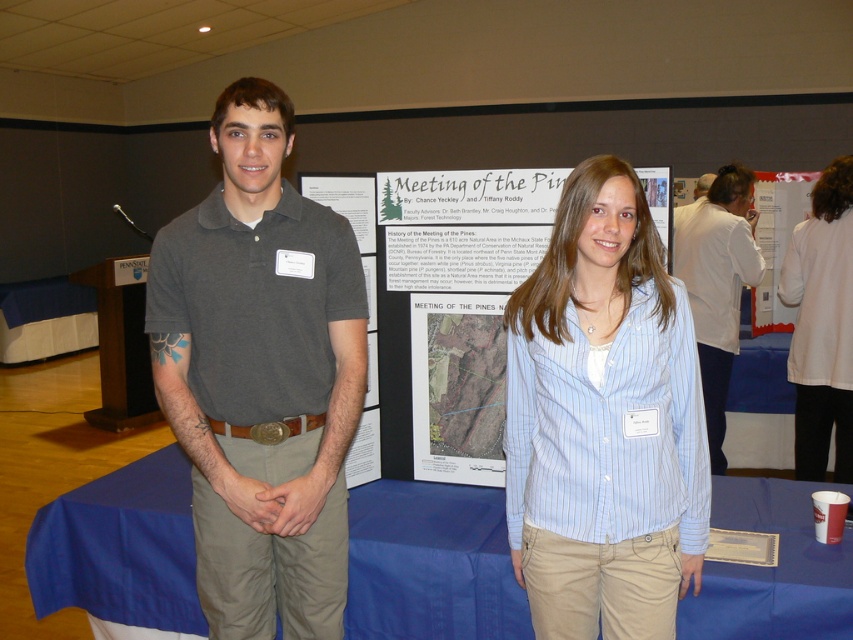
You are standing at the point labeled as point (585,392) and want to greet someone who is 4.73 feet away from you. Is the person you want to greet located closer to the front or the back of the room?

The person you want to greet is located closer to the front of the room because the distance between point (585,392) and the viewer is 4.73 feet, which suggests they are near the front where the podium is situated.